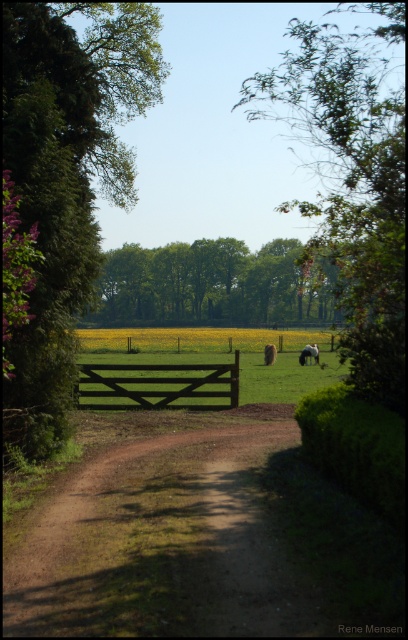
Can you confirm if brown dirt track at center is positioned above green leafy trees at center?

Actually, brown dirt track at center is below green leafy trees at center.

Consider the image. Between brown dirt track at center and green leafy trees at center, which one has more height?

green leafy trees at center

Is point (161, 605) farther from camera compared to point (226, 289)?

No, it is in front of (226, 289).

Find the location of a particular element. The width and height of the screenshot is (408, 640). brown dirt track at center is located at coordinates (157, 545).

Can you confirm if black wooden gate at center is smaller than brown woolen sheep at center?

Actually, black wooden gate at center might be larger than brown woolen sheep at center.

Can you confirm if black wooden gate at center is positioned above brown woolen sheep at center?

Incorrect, black wooden gate at center is not positioned above brown woolen sheep at center.

I want to click on black wooden gate at center, so [159, 385].

Is point (348, 348) farther from camera compared to point (170, 376)?

No, it is in front of (170, 376).

Is green leafy tree at upper center wider than black wooden gate at center?

Correct, the width of green leafy tree at upper center exceeds that of black wooden gate at center.

In order to click on green leafy tree at upper center in this screenshot , I will do `click(352, 182)`.